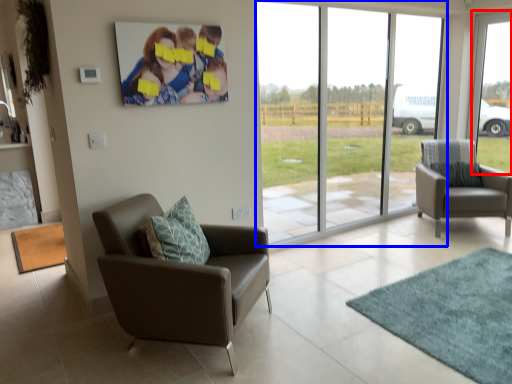
Question: Which object is further to the camera taking this photo, window (highlighted by a red box) or window (highlighted by a blue box)?

Choices:
 (A) window
 (B) window

Answer: (A)